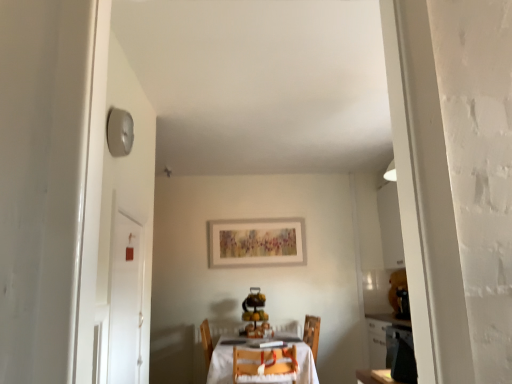
Question: Is white wooden table at center smaller than white glossy door at left?

Choices:
 (A) yes
 (B) no

Answer: (B)

Question: Would you say white wooden table at center is outside white glossy door at left?

Choices:
 (A) no
 (B) yes

Answer: (B)

Question: Considering the relative sizes of white wooden table at center and white glossy door at left in the image provided, is white wooden table at center thinner than white glossy door at left?

Choices:
 (A) no
 (B) yes

Answer: (A)

Question: Is white wooden table at center beside white glossy door at left?

Choices:
 (A) no
 (B) yes

Answer: (A)

Question: Could you tell me if white wooden table at center is turned towards white glossy door at left?

Choices:
 (A) yes
 (B) no

Answer: (B)

Question: Considering the positions of white glossy door at left and wooden chair at center in the image, is white glossy door at left wider or thinner than wooden chair at center?

Choices:
 (A) wide
 (B) thin

Answer: (B)

Question: Is white glossy door at left to the left or to the right of wooden chair at center in the image?

Choices:
 (A) right
 (B) left

Answer: (B)

Question: From the image's perspective, relative to wooden chair at center, is white glossy door at left above or below?

Choices:
 (A) above
 (B) below

Answer: (A)

Question: Considering the positions of white glossy door at left and wooden chair at center in the image, is white glossy door at left taller or shorter than wooden chair at center?

Choices:
 (A) short
 (B) tall

Answer: (B)

Question: Would you say wooden chair at center is to the left or to the right of white glossy door at left in the picture?

Choices:
 (A) right
 (B) left

Answer: (A)

Question: Looking at the image, does wooden chair at center seem bigger or smaller compared to white glossy door at left?

Choices:
 (A) big
 (B) small

Answer: (A)

Question: From a real-world perspective, is wooden chair at center positioned above or below white glossy door at left?

Choices:
 (A) below
 (B) above

Answer: (A)

Question: From their relative heights in the image, would you say wooden chair at center is taller or shorter than white glossy door at left?

Choices:
 (A) tall
 (B) short

Answer: (B)

Question: Considering their positions, is white wooden table at center located in front of or behind wooden chair at center?

Choices:
 (A) front
 (B) behind

Answer: (B)

Question: Is white wooden table at center taller or shorter than wooden chair at center?

Choices:
 (A) short
 (B) tall

Answer: (B)